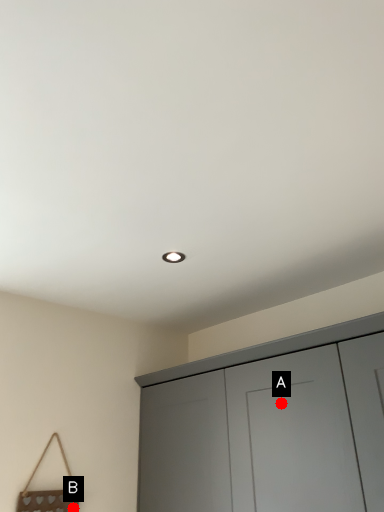
Question: Two points are circled on the image, labeled by A and B beside each circle. Which point is farther to the camera?

Choices:
 (A) A is further
 (B) B is further

Answer: (B)